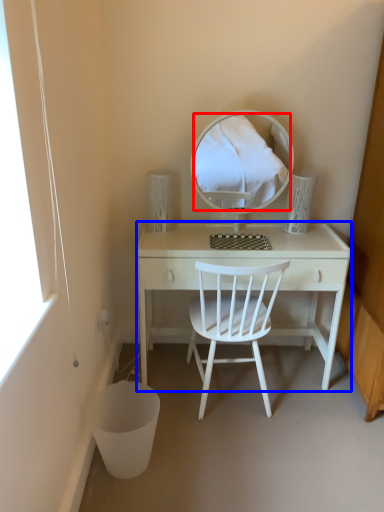
Question: Among these objects, which one is nearest to the camera, mirror (highlighted by a red box) or desk (highlighted by a blue box)?

Choices:
 (A) mirror
 (B) desk

Answer: (A)